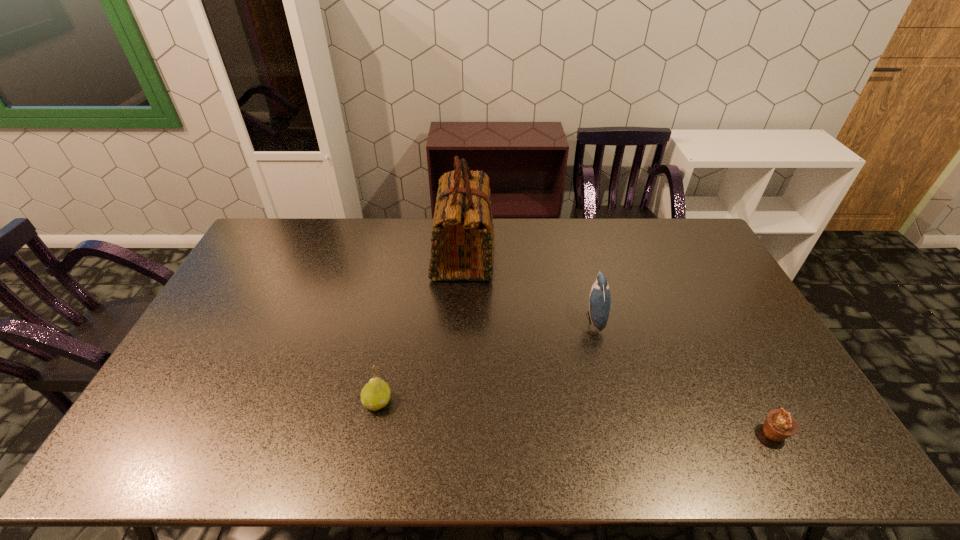
In the image, there is a desktop. At what (x,y) coordinates should I click in order to perform the action: click on vacant space at the left edge. Please return your answer as a coordinate pair (x, y). This screenshot has width=960, height=540. Looking at the image, I should click on (225, 299).

The image size is (960, 540). I want to click on vacant space at the right edge, so click(734, 335).

In the image, there is a desktop. Where is `free space at the far right corner`? This screenshot has width=960, height=540. free space at the far right corner is located at coordinates [666, 218].

Where is `vacant area that lies between the shortest object and the bird`? The height and width of the screenshot is (540, 960). vacant area that lies between the shortest object and the bird is located at coordinates (684, 376).

Locate an element on the screen. free spot between the third farthest object and the third shortest object is located at coordinates (486, 360).

This screenshot has height=540, width=960. I want to click on free space between the bird and the pear, so click(x=486, y=360).

Find the location of a particular element. This screenshot has width=960, height=540. vacant space in between the second shortest object and the third shortest object is located at coordinates (486, 360).

Identify the location of vacant space that's between the shortest object and the shopping bag. The height and width of the screenshot is (540, 960). (619, 344).

This screenshot has width=960, height=540. I want to click on vacant space in between the pear and the shopping bag, so click(420, 328).

Where is `free space between the muffin and the third tallest object`? The height and width of the screenshot is (540, 960). free space between the muffin and the third tallest object is located at coordinates (575, 417).